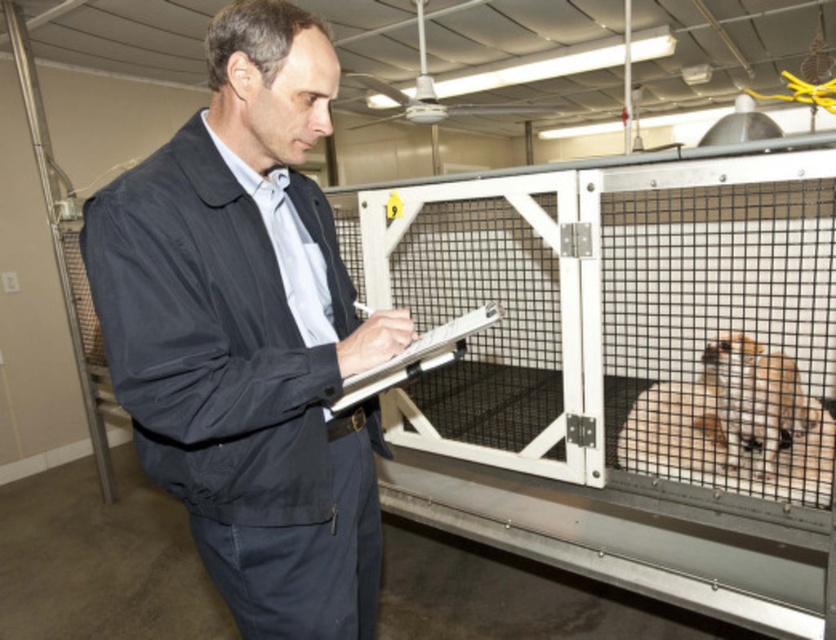
Question: Can you confirm if dark blue fabric jacket at center is smaller than light brown fur at right?

Choices:
 (A) no
 (B) yes

Answer: (A)

Question: Which object is positioned farthest from the light brown fur at right?

Choices:
 (A) white plastic clipboard at center
 (B) dark blue fabric jacket at center

Answer: (B)

Question: Which object is farther from the camera taking this photo?

Choices:
 (A) light brown fur at right
 (B) dark blue fabric jacket at center
 (C) white plastic clipboard at center

Answer: (A)

Question: Observing the image, what is the correct spatial positioning of light brown fur at right in reference to white plastic clipboard at center?

Choices:
 (A) above
 (B) below

Answer: (B)

Question: Which object is farther from the camera taking this photo?

Choices:
 (A) light brown fur at right
 (B) dark blue fabric jacket at center
 (C) white plastic clipboard at center

Answer: (A)

Question: Does light brown fur at right come in front of white plastic clipboard at center?

Choices:
 (A) yes
 (B) no

Answer: (B)